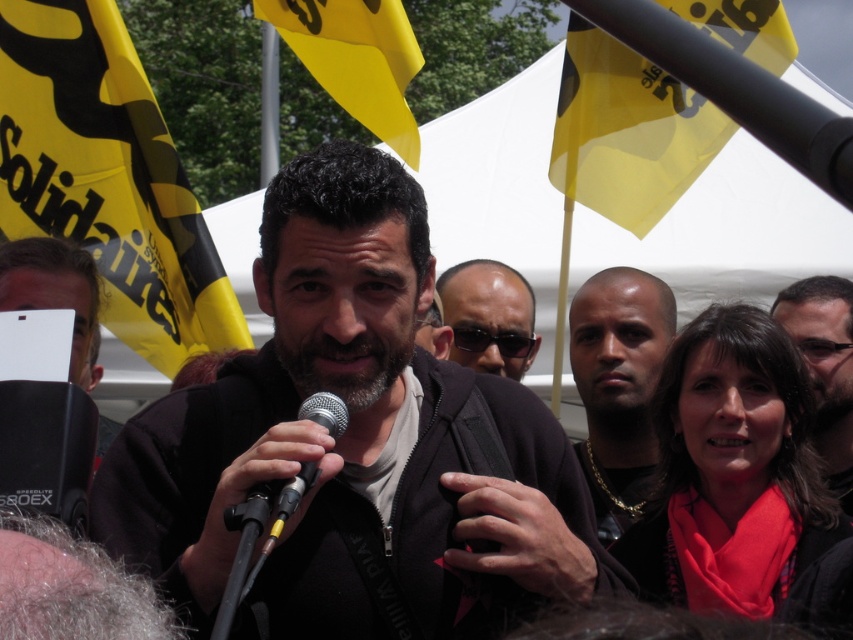
Question: Which point is closer to the camera taking this photo?

Choices:
 (A) (668, 140)
 (B) (169, 253)

Answer: (B)

Question: Among these objects, which one is nearest to the camera?

Choices:
 (A) yellow plastic flag at upper right
 (B) matte black hair at upper right
 (C) matte black sunglasses at center

Answer: (B)

Question: Which point is farther from the camera taking this photo?

Choices:
 (A) (413, 140)
 (B) (579, 522)

Answer: (A)

Question: Does matte black jacket at center come in front of yellow fabric flag at upper left?

Choices:
 (A) yes
 (B) no

Answer: (A)

Question: Is matte black jacket at center positioned before metallic silver microphone at center?

Choices:
 (A) yes
 (B) no

Answer: (A)

Question: Is matte black jacket at center thinner than white plastic sign at lower left?

Choices:
 (A) no
 (B) yes

Answer: (B)